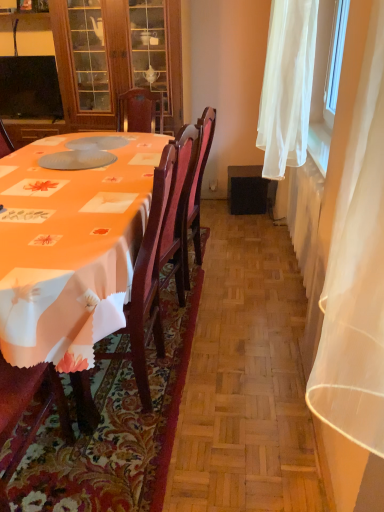
The width and height of the screenshot is (384, 512). Find the location of `black glossy television at upper left`. black glossy television at upper left is located at coordinates (29, 88).

Describe the element at coordinates (89, 64) in the screenshot. I see `matte wood cabinet at upper left` at that location.

Find the location of a particular element. This screenshot has height=512, width=384. wooden chair at left is located at coordinates (148, 284).

Identify the location of white sheer curtain at right. (287, 85).

Where is `black glossy television at upper left`? black glossy television at upper left is located at coordinates (29, 88).

Based on the photo, is black glossy television at upper left beside matte wood cabinet at upper left?

No.

From a real-world perspective, relative to matte wood cabinet at upper left, is black glossy television at upper left vertically above or below?

black glossy television at upper left is situated lower than matte wood cabinet at upper left in the real world.

Relative to matte wood cabinet at upper left, is black glossy television at upper left in front or behind?

black glossy television at upper left is behind matte wood cabinet at upper left.

Which of these two, orange fabric tablecloth at center or black glossy television at upper left, stands shorter?

orange fabric tablecloth at center is shorter.

Is orange fabric tablecloth at center placed right next to black glossy television at upper left?

No, orange fabric tablecloth at center is not touching black glossy television at upper left.

From the image's perspective, is orange fabric tablecloth at center beneath black glossy television at upper left?

Yes, from the image's perspective, orange fabric tablecloth at center is below black glossy television at upper left.

How many degrees apart are the facing directions of orange fabric tablecloth at center and black glossy television at upper left?

They differ by 87.8 degrees in their facing directions.

Where is `mat directly beneath the white sheer curtain at right (from a real-world perspective)`? The width and height of the screenshot is (384, 512). mat directly beneath the white sheer curtain at right (from a real-world perspective) is located at coordinates (115, 430).

Is white sheer curtain at right far from orange fabric tablecloth at center?

white sheer curtain at right is far away from orange fabric tablecloth at center.

Between white sheer curtain at right and orange fabric tablecloth at center, which one is positioned in front?

orange fabric tablecloth at center is closer to the camera.

Is white sheer curtain at right bigger or smaller than orange fabric tablecloth at center?

white sheer curtain at right is bigger than orange fabric tablecloth at center.

Is matte wood cabinet at upper left to the left or to the right of orange fabric tablecloth at center in the image?

matte wood cabinet at upper left is to the left of orange fabric tablecloth at center.

You are a GUI agent. You are given a task and a screenshot of the screen. Output one action in this format:
    pyautogui.click(x=<x>, y=<y>)
    Task: Click on the mat in front of the matte wood cabinet at upper left
    Image resolution: width=384 pixels, height=512 pixels.
    Given the screenshot: What is the action you would take?
    pyautogui.click(x=115, y=430)

From the image's perspective, which is above, matte wood cabinet at upper left or orange fabric tablecloth at center?

matte wood cabinet at upper left appears higher in the image.

Is the position of matte wood cabinet at upper left less distant than that of orange fabric tablecloth at center?

No.

Could wooden chair at left be considered to be inside black glossy television at upper left?

No, wooden chair at left is not a part of black glossy television at upper left.

Considering the positions of objects black glossy television at upper left and wooden chair at left in the image provided, who is more to the left, black glossy television at upper left or wooden chair at left?

Positioned to the left is black glossy television at upper left.

Can you tell me how much black glossy television at upper left and wooden chair at left differ in facing direction?

The facing directions of black glossy television at upper left and wooden chair at left are 86.6 degrees apart.

Would you consider orange fabric tablecloth at center to be distant from matte wood cabinet at upper left?

Yes, orange fabric tablecloth at center and matte wood cabinet at upper left are located far from each other.

Based on the photo, from a real-world perspective, is orange fabric tablecloth at center physically located above or below matte wood cabinet at upper left?

orange fabric tablecloth at center is below matte wood cabinet at upper left.

Does orange fabric tablecloth at center have a lesser width compared to matte wood cabinet at upper left?

No, orange fabric tablecloth at center is not thinner than matte wood cabinet at upper left.

Is orange fabric tablecloth at center smaller than matte wood cabinet at upper left?

Yes.

Consider the image. Which is more to the left, matte wood cabinet at upper left or white sheer curtain at right?

matte wood cabinet at upper left is more to the left.

Consider the image. Can you confirm if matte wood cabinet at upper left is bigger than white sheer curtain at right?

Yes, matte wood cabinet at upper left is bigger than white sheer curtain at right.

Is matte wood cabinet at upper left not within white sheer curtain at right?

That's correct, matte wood cabinet at upper left is outside of white sheer curtain at right.

Find the location of `cabinetry to the right of black glossy television at upper left`. cabinetry to the right of black glossy television at upper left is located at coordinates (89, 64).

Find the location of a particular element. This screenshot has height=512, width=384. mat below the black glossy television at upper left (from a real-world perspective) is located at coordinates (115, 430).

Estimate the real-world distances between objects in this image. Which object is closer to white sheer curtain at right, orange fabric tablecloth at center or wooden chair at left?

wooden chair at left.

Estimate the real-world distances between objects in this image. Which object is closer to orange fabric tablecloth at center, white sheer curtain at right or black glossy television at upper left?

white sheer curtain at right is positioned closer to the anchor orange fabric tablecloth at center.

Looking at the image, which one is located closer to wooden chair at left, white sheer curtain at right or black glossy television at upper left?

Based on the image, white sheer curtain at right appears to be nearer to wooden chair at left.

When comparing their distances from matte wood cabinet at upper left, does white sheer curtain at right or orange fabric tablecloth at center seem closer?

white sheer curtain at right.

From the image, which object appears to be farther from wooden chair at left, black glossy television at upper left or orange fabric tablecloth at center?

black glossy television at upper left.

Considering their positions, is matte wood cabinet at upper left positioned closer to wooden chair at left than white sheer curtain at right?

Among the two, white sheer curtain at right is located nearer to wooden chair at left.

Based on their spatial positions, is white sheer curtain at right or wooden chair at left further from black glossy television at upper left?

wooden chair at left lies further to black glossy television at upper left than the other object.

Looking at the image, which one is located further to matte wood cabinet at upper left, orange fabric tablecloth at center or white sheer curtain at right?

orange fabric tablecloth at center is positioned further to the anchor matte wood cabinet at upper left.

Locate an element on the screen. The height and width of the screenshot is (512, 384). chair between matte wood cabinet at upper left and orange fabric tablecloth at center in the vertical direction is located at coordinates (148, 284).

You are a GUI agent. You are given a task and a screenshot of the screen. Output one action in this format:
    pyautogui.click(x=<x>, y=<y>)
    Task: Click on the curtain between matte wood cabinet at upper left and orange fabric tablecloth at center in the up-down direction
    
    Given the screenshot: What is the action you would take?
    pyautogui.click(x=287, y=85)

Identify the location of cabinetry positioned between orange fabric tablecloth at center and black glossy television at upper left from near to far. (89, 64).

Where is `curtain between wooden chair at left and matte wood cabinet at upper left from front to back`? The width and height of the screenshot is (384, 512). curtain between wooden chair at left and matte wood cabinet at upper left from front to back is located at coordinates (287, 85).